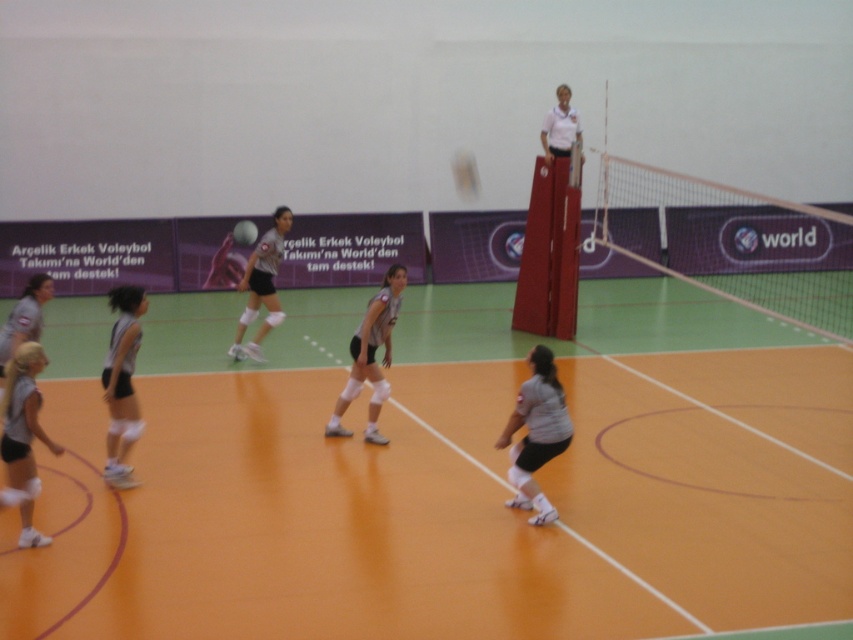
Question: Which point is closer to the camera?

Choices:
 (A) (253, 236)
 (B) (260, 253)
 (C) (677, 186)

Answer: (B)

Question: Estimate the real-world distances between objects in this image. Which object is closer to the gray matte uniform at lower left?

Choices:
 (A) white knee pads at center
 (B) white mesh net at upper center
 (C) gray matte uniform at lower right

Answer: (A)

Question: Is matte gray shorts at lower left further to camera compared to white knee pads at center?

Choices:
 (A) yes
 (B) no

Answer: (B)

Question: Which point is closer to the camera?

Choices:
 (A) white knee pads at center
 (B) gray matte uniform at lower right
 (C) matte gray shorts at lower left
 (D) white matte volleyball at center

Answer: (C)

Question: In this image, where is white knee pads at center located relative to white matte volleyball at center?

Choices:
 (A) right
 (B) left

Answer: (A)

Question: Is white mesh net at upper center wider than white knee pads at center?

Choices:
 (A) yes
 (B) no

Answer: (A)